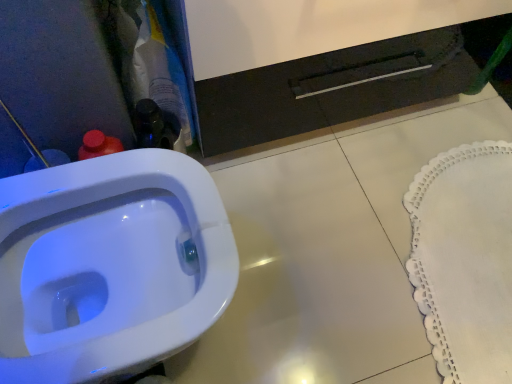
Question: Based on their sizes in the image, would you say white lace doily at lower right is bigger or smaller than white glossy toilet at lower left?

Choices:
 (A) big
 (B) small

Answer: (B)

Question: From the image's perspective, is white lace doily at lower right positioned above or below white glossy toilet at lower left?

Choices:
 (A) below
 (B) above

Answer: (B)

Question: Does point (431, 241) appear closer or farther from the camera than point (165, 248)?

Choices:
 (A) farther
 (B) closer

Answer: (A)

Question: Is point pyautogui.click(x=61, y=221) positioned closer to the camera than point pyautogui.click(x=498, y=324)?

Choices:
 (A) farther
 (B) closer

Answer: (B)

Question: From the image's perspective, is white glossy toilet at lower left positioned above or below white lace doily at lower right?

Choices:
 (A) above
 (B) below

Answer: (B)

Question: Is white glossy toilet at lower left taller or shorter than white lace doily at lower right?

Choices:
 (A) short
 (B) tall

Answer: (B)

Question: Is white glossy toilet at lower left bigger or smaller than white lace doily at lower right?

Choices:
 (A) small
 (B) big

Answer: (B)